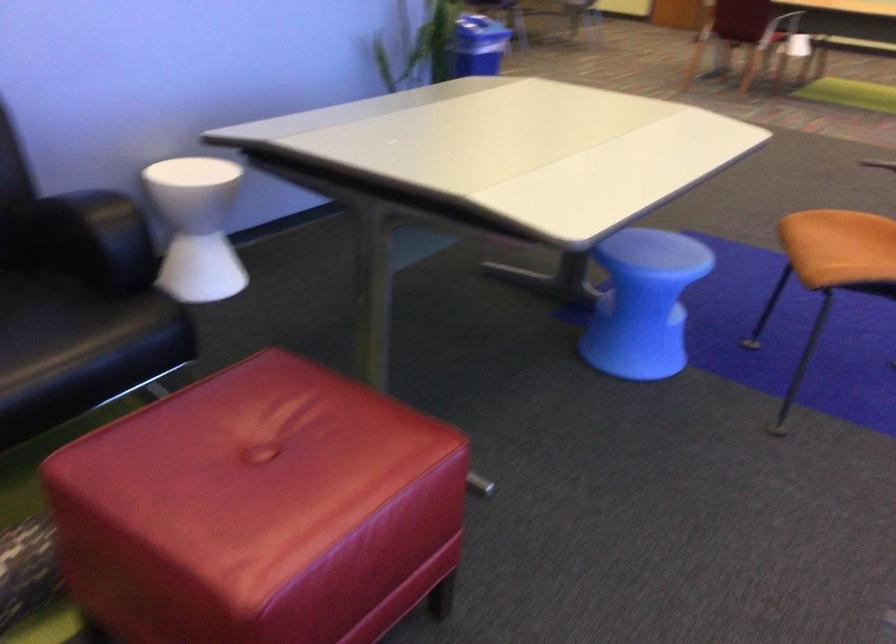
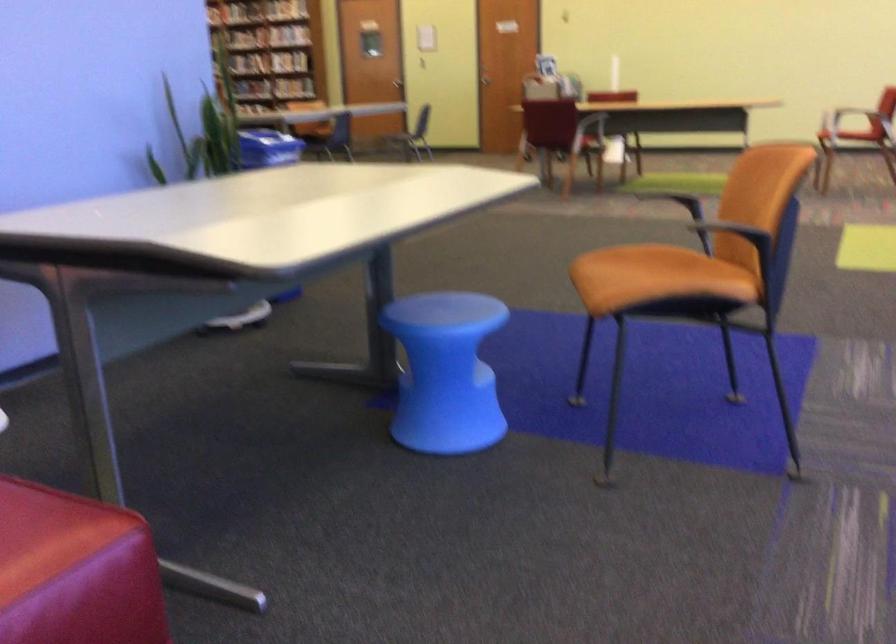
Question: Based on the continuous images, in which direction is the camera rotating? Reply with the corresponding letter.

Choices:
 (A) Left
 (B) Right
 (C) Up
 (D) Down

Answer: (C)